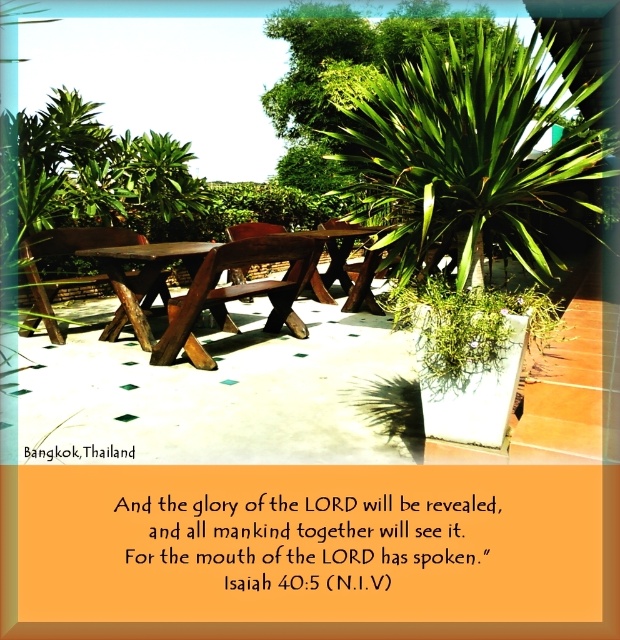
Question: Does natural wood table at center appear on the left side of brown wooden table at center?

Choices:
 (A) yes
 (B) no

Answer: (A)

Question: In this image, where is natural wood table at center located relative to brown wooden table at center?

Choices:
 (A) right
 (B) left

Answer: (B)

Question: Which object is farther from the camera taking this photo?

Choices:
 (A) natural wood table at center
 (B) brown wooden table at center

Answer: (B)

Question: Among these points, which one is farthest from the camera?

Choices:
 (A) (329, 257)
 (B) (273, 288)
 (C) (169, 259)

Answer: (A)

Question: Is dark brown wood picnic table at center bigger than natural wood table at center?

Choices:
 (A) yes
 (B) no

Answer: (A)

Question: Considering the real-world distances, which object is farthest from the natural wood table at center?

Choices:
 (A) dark brown wood picnic table at center
 (B) brown wooden table at center

Answer: (B)